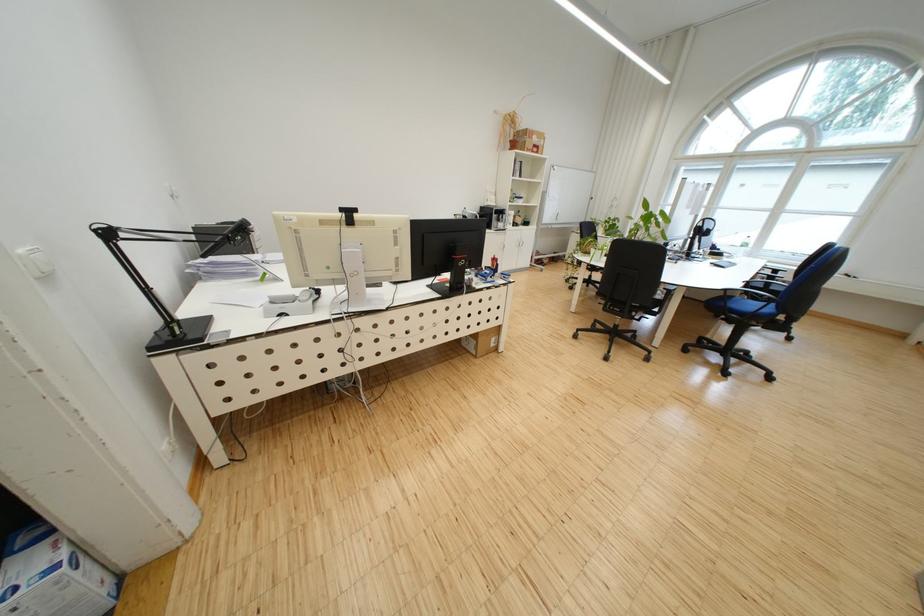
Where would you resting arm the blue chair armrest? Please return your answer as a coordinate pair (x, y).

(760, 294)